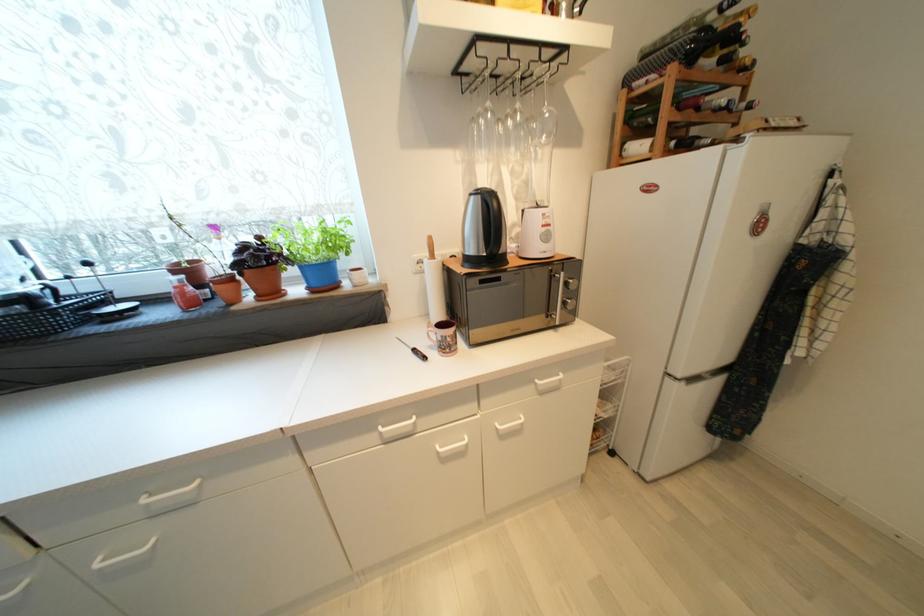
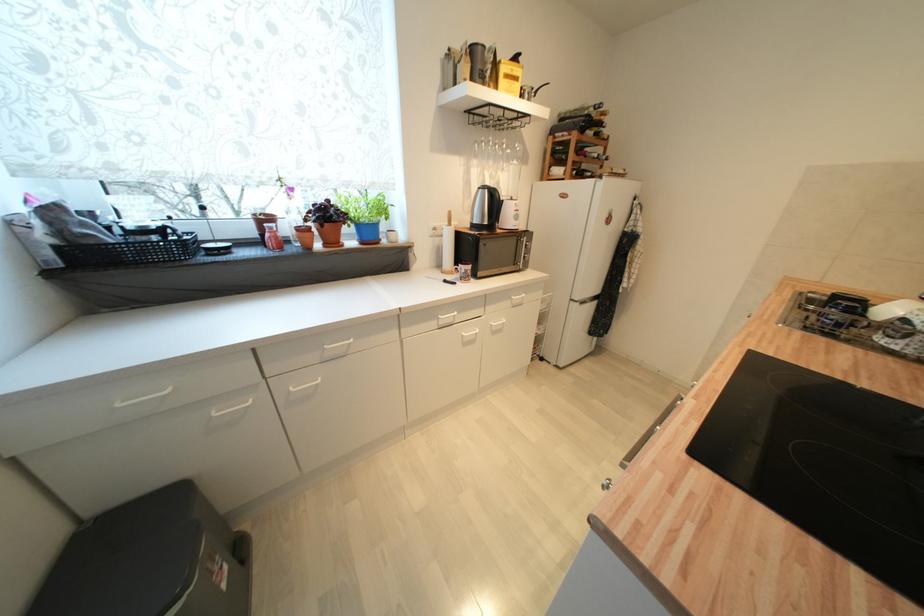
In the second image, find the point that corresponds to [545,390] in the first image.

(518, 304)